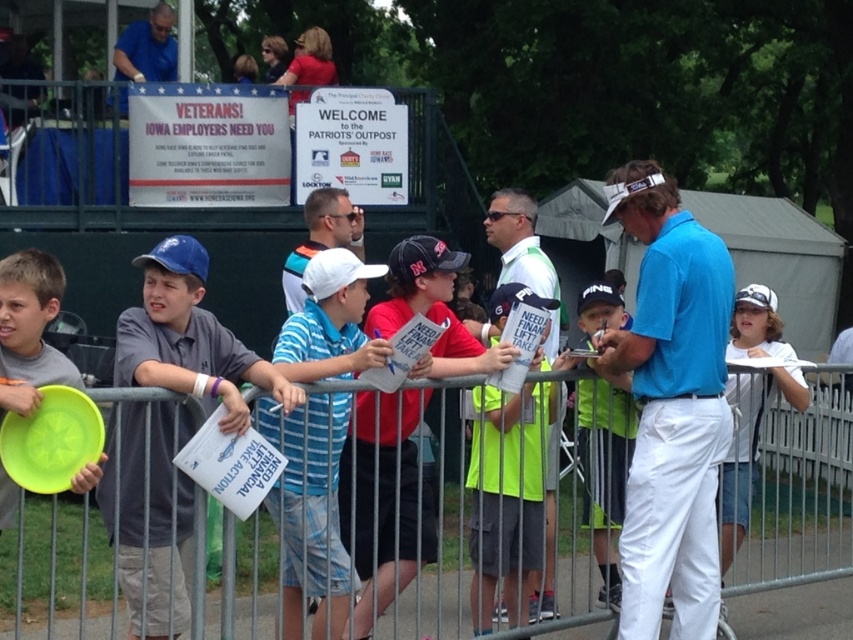
You are a photographer at the golf tournament and need to capture a clear shot of both the blue striped shirt at center and the neon yellow shirt at center. Based on their positions, which shirt should you focus on first to ensure both are in frame?

The blue striped shirt at center is located below the neon yellow shirt at center. To ensure both are in frame, focus on the neon yellow shirt at center first, then adjust to include the lower positioned blue striped shirt at center.